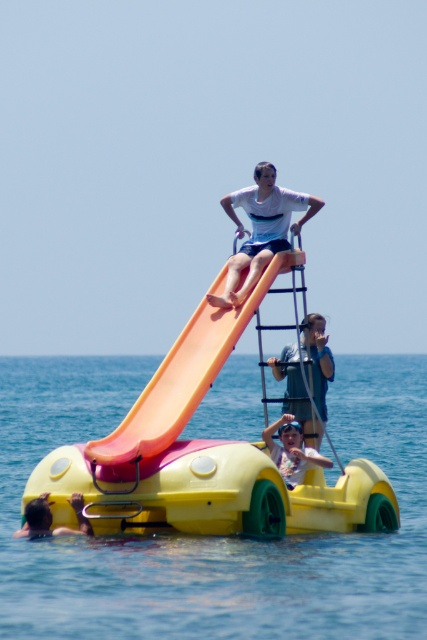
You are a lifeguard at the beach and need to ensure safety. The orange matte slide at upper center and the blue denim shorts at center are in your view. Which object is taller?

The orange matte slide at upper center is much taller than the blue denim shorts at center.

You are standing at point point (64, 410) and want to take a photo of the entire scene. The camera is 152.71 meters away from you. Is the camera close enough to capture the entire scene in one shot?

The camera is 152.71 meters away from point (64, 410), which is likely too far to capture the entire scene in one shot.

You are planning to organize a water activity event and need to know which object takes up more space in the image. Based on the scene, which one is wider between the transparent plastic water at center and the yellow matte pedal boat at upper center?

The transparent plastic water at center is wider than the yellow matte pedal boat at upper center according to the description.